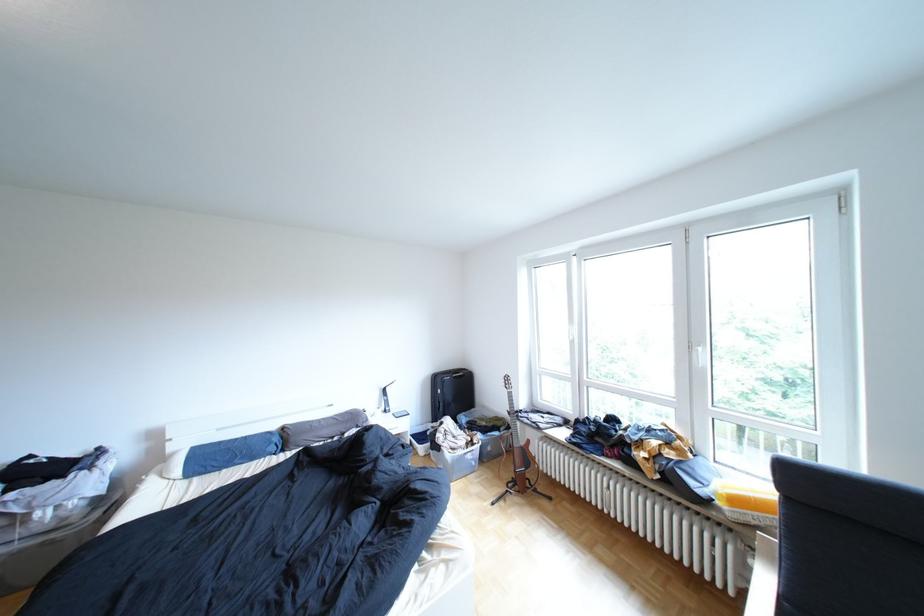
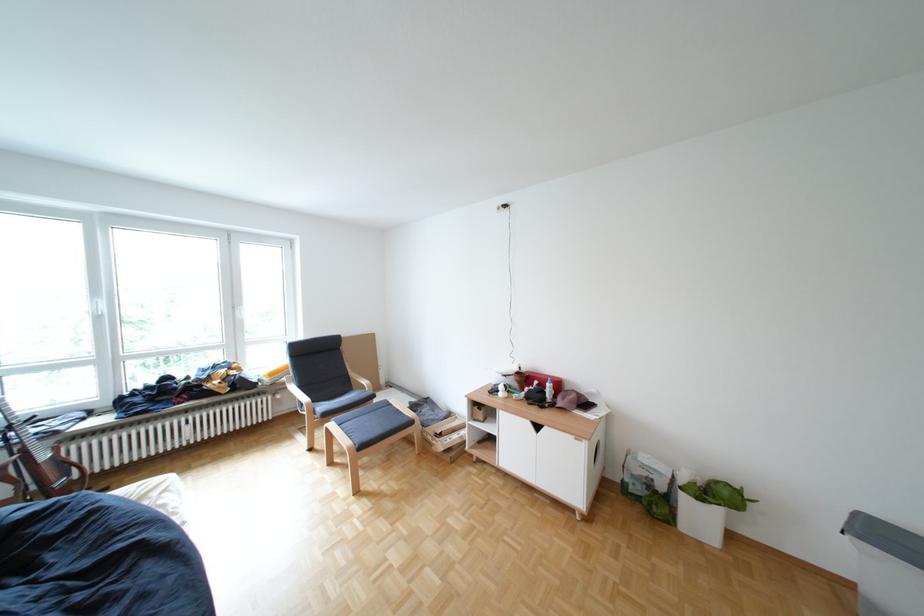
The point at (751, 503) is marked in the first image. Where is the corresponding point in the second image?

(286, 374)